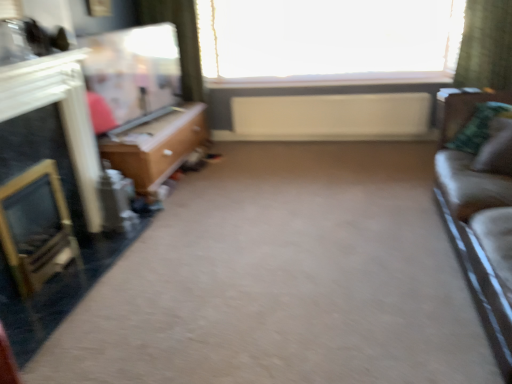
Question: Can you confirm if wooden desk at left is bigger than green plaid pillow at right, which appears as the 2th pillow when viewed from the front?

Choices:
 (A) no
 (B) yes

Answer: (B)

Question: Is wooden desk at left outside green plaid pillow at right, which appears as the 2th pillow when viewed from the front?

Choices:
 (A) yes
 (B) no

Answer: (A)

Question: Does wooden desk at left come behind green plaid pillow at right, which appears as the 2th pillow when viewed from the front?

Choices:
 (A) no
 (B) yes

Answer: (B)

Question: Is wooden desk at left far from green plaid pillow at right, which appears as the 2th pillow when viewed from the front?

Choices:
 (A) no
 (B) yes

Answer: (B)

Question: Does wooden desk at left appear on the right side of green plaid pillow at right, which appears as the 2th pillow when viewed from the front?

Choices:
 (A) no
 (B) yes

Answer: (A)

Question: Can you confirm if wooden desk at left is positioned to the left of green plaid pillow at right, which appears as the 2th pillow when viewed from the front?

Choices:
 (A) yes
 (B) no

Answer: (A)

Question: Can you confirm if wooden desk at left is positioned to the left of matte wood entertainment center at upper left?

Choices:
 (A) yes
 (B) no

Answer: (B)

Question: Is wooden desk at left touching matte wood entertainment center at upper left?

Choices:
 (A) yes
 (B) no

Answer: (B)

Question: Can you confirm if wooden desk at left is wider than matte wood entertainment center at upper left?

Choices:
 (A) yes
 (B) no

Answer: (A)

Question: Can you confirm if wooden desk at left is positioned to the right of matte wood entertainment center at upper left?

Choices:
 (A) no
 (B) yes

Answer: (B)

Question: From a real-world perspective, is wooden desk at left located beneath matte wood entertainment center at upper left?

Choices:
 (A) no
 (B) yes

Answer: (B)

Question: Considering the relative sizes of wooden desk at left and matte wood entertainment center at upper left in the image provided, is wooden desk at left bigger than matte wood entertainment center at upper left?

Choices:
 (A) no
 (B) yes

Answer: (B)

Question: Does green plaid pillow at right, the first pillow from the back, have a lesser height compared to white matte radiator at center?

Choices:
 (A) no
 (B) yes

Answer: (B)